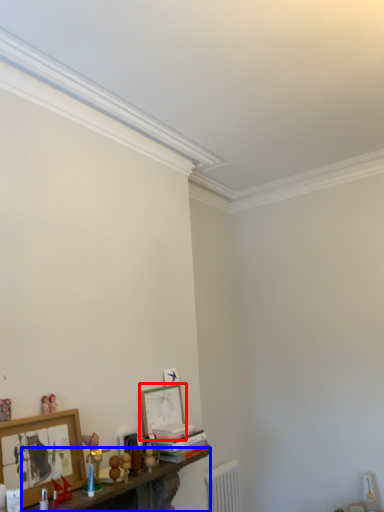
Question: Which object appears farthest to the camera in this image, picture frame (highlighted by a red box) or shelf (highlighted by a blue box)?

Choices:
 (A) picture frame
 (B) shelf

Answer: (A)